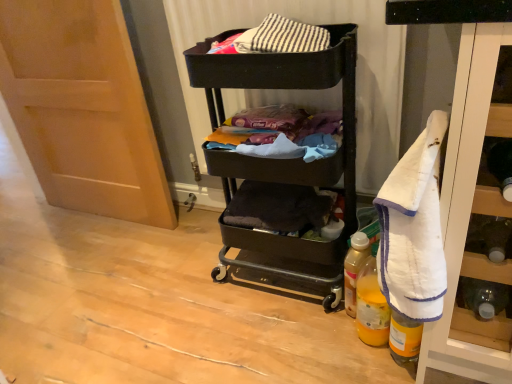
Locate an element on the screen. The image size is (512, 384). vacant space that is to the left of translucent yellow plastic bottle at lower right, which is the 2th bottle in front-to-back order is located at coordinates (313, 345).